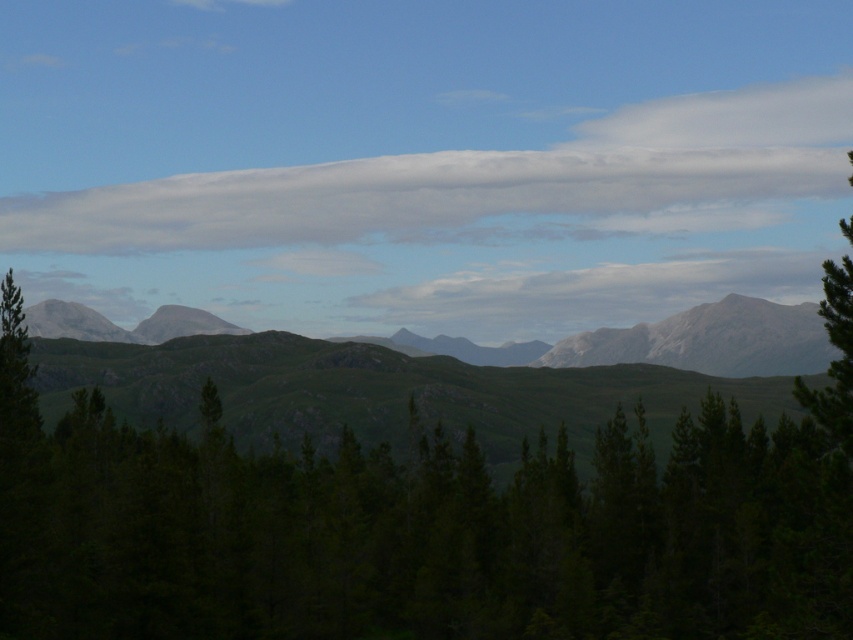
Between white fluffy cloud at upper center and gray rocky mountains at center, which one is positioned higher?

white fluffy cloud at upper center

Who is positioned more to the left, white fluffy cloud at upper center or gray rocky mountains at center?

gray rocky mountains at center is more to the left.

Which is in front, point (15, 250) or point (720, 307)?

Positioned in front is point (720, 307).

At what (x,y) coordinates should I click in order to perform the action: click on white fluffy cloud at upper center. Please return your answer as a coordinate pair (x, y). This screenshot has width=853, height=640. Looking at the image, I should click on (485, 184).

Is the position of white fluffy cloud at upper center less distant than that of gray rock mountain range at center?

No.

This screenshot has height=640, width=853. Find the location of `white fluffy cloud at upper center`. white fluffy cloud at upper center is located at coordinates (485, 184).

Is gray rock mountain range at center positioned in front of gray rocky mountains at center?

Yes, gray rock mountain range at center is in front of gray rocky mountains at center.

Does gray rock mountain range at center appear on the left side of gray rocky mountains at center?

No, gray rock mountain range at center is not to the left of gray rocky mountains at center.

Between point (79, 372) and point (560, 364), which one is positioned in front?

Point (79, 372) is in front.

Image resolution: width=853 pixels, height=640 pixels. Find the location of `gray rock mountain range at center`. gray rock mountain range at center is located at coordinates (376, 392).